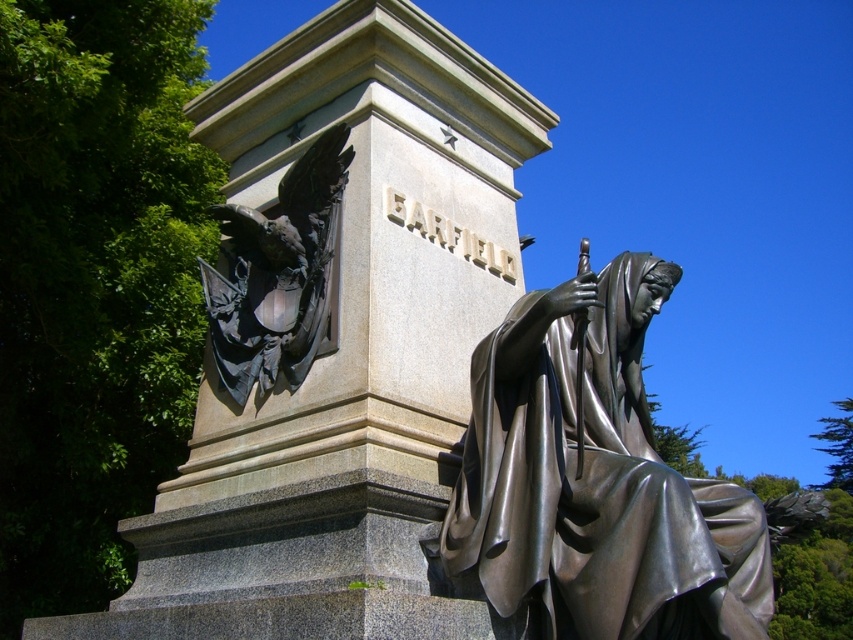
You are a sculptor planning to place a new sculpture between the bronze statue at center and the polished bronze eagle at left. Considering their widths, which object should you position closer to the narrower side to ensure proper spacing?

The bronze statue at center is wider than the polished bronze eagle at left. Therefore, to ensure proper spacing, you should position the polished bronze eagle at left closer to the narrower side.

You are an art student analyzing the composition of the monument. You notice the bronze statue at center and the polished bronze eagle at left. Which object is positioned lower in the scene?

The bronze statue at center is positioned lower than the polished bronze eagle at left.